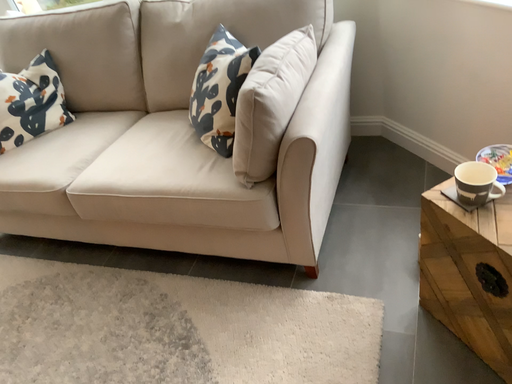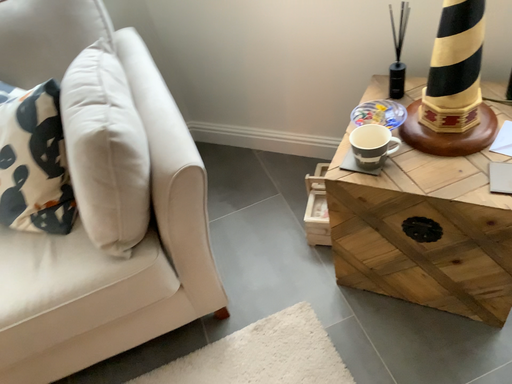
Question: How did the camera likely rotate when shooting the video?

Choices:
 (A) rotated right
 (B) rotated left

Answer: (A)